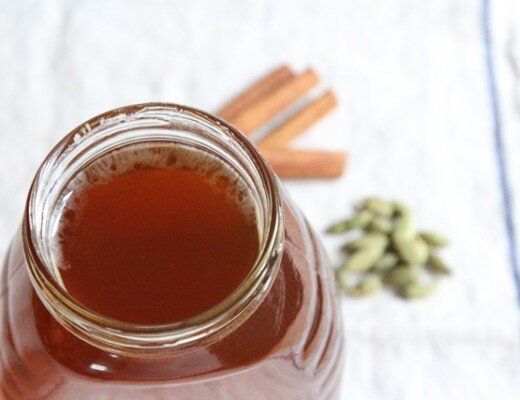
Image resolution: width=520 pixels, height=400 pixels. I want to click on glass jar, so click(293, 332).